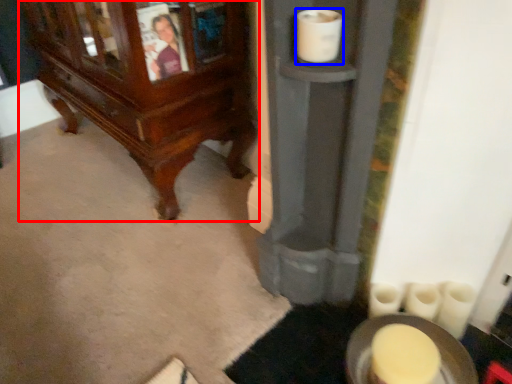
Question: Which object is further to the camera taking this photo, furniture (highlighted by a red box) or toilet paper (highlighted by a blue box)?

Choices:
 (A) furniture
 (B) toilet paper

Answer: (A)